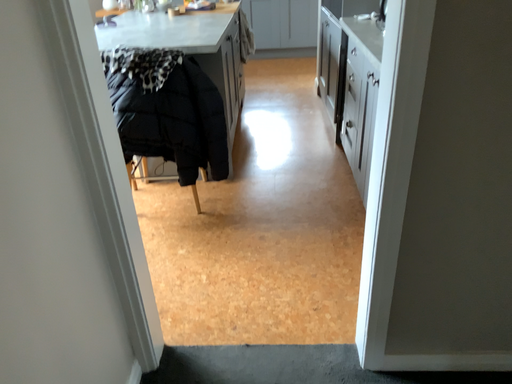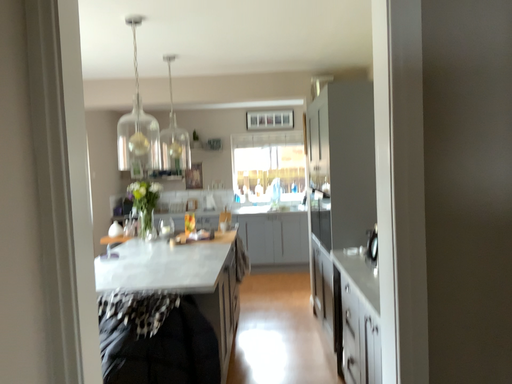
Question: Which way did the camera rotate in the video?

Choices:
 (A) rotated downward
 (B) rotated upward

Answer: (B)